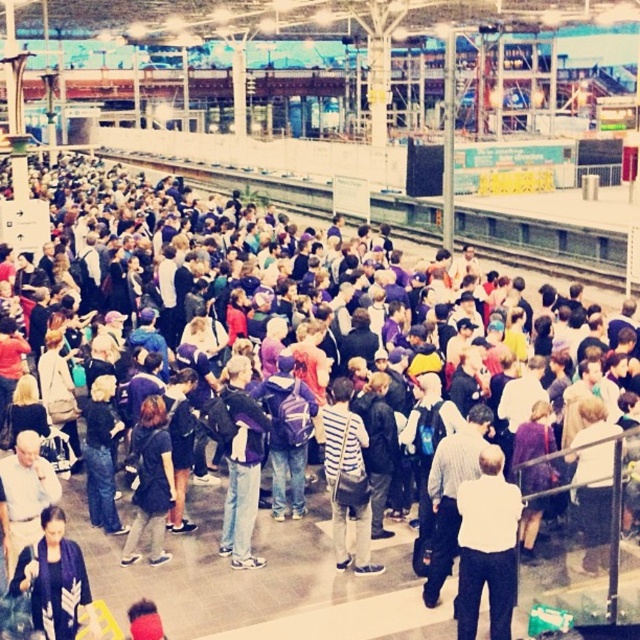
Can you confirm if purple fabric backpack at center is positioned to the right of striped fabric shirt at center?

No, purple fabric backpack at center is not to the right of striped fabric shirt at center.

Locate an element on the screen. Image resolution: width=640 pixels, height=640 pixels. purple fabric backpack at center is located at coordinates (243, 465).

Does point (240, 492) lie behind point (323, 416)?

No, it is not.

The height and width of the screenshot is (640, 640). I want to click on purple fabric backpack at center, so click(x=243, y=465).

The image size is (640, 640). What do you see at coordinates (486, 547) in the screenshot? I see `white matte shirt at center` at bounding box center [486, 547].

Can you confirm if white matte shirt at center is smaller than dark blue textured jacket at lower left?

Incorrect, white matte shirt at center is not smaller in size than dark blue textured jacket at lower left.

Is point (460, 534) closer to viewer compared to point (22, 563)?

No, it is behind (22, 563).

This screenshot has height=640, width=640. Identify the location of white matte shirt at center. (486, 547).

Between point (76, 579) and point (252, 440), which one is positioned in front?

Point (76, 579)

What do you see at coordinates (54, 580) in the screenshot? I see `dark blue textured jacket at lower left` at bounding box center [54, 580].

This screenshot has width=640, height=640. I want to click on dark blue textured jacket at lower left, so click(x=54, y=580).